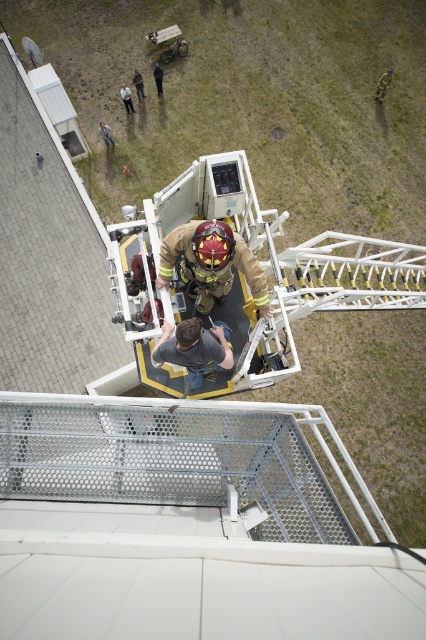
Question: In this image, where is camouflage fabric person at center located relative to brown leather jacket at upper center?

Choices:
 (A) below
 (B) above

Answer: (B)

Question: Among these points, which one is farthest from the camera?

Choices:
 (A) (123, 92)
 (B) (233, 260)
 (C) (138, 74)

Answer: (C)

Question: Which of the following is the farthest from the observer?

Choices:
 (A) gray matte shirt at center
 (B) brown leather jacket at upper center

Answer: (B)

Question: Can you confirm if firefighter uniform at center is positioned above gray matte shirt at center?

Choices:
 (A) yes
 (B) no

Answer: (A)

Question: Does camouflage fabric person at center have a lesser width compared to light brown leather jacket at upper center?

Choices:
 (A) yes
 (B) no

Answer: (B)

Question: Among these objects, which one is farthest from the camera?

Choices:
 (A) dark brown leather jacket at upper center
 (B) brushed metal helmet at upper center

Answer: (A)